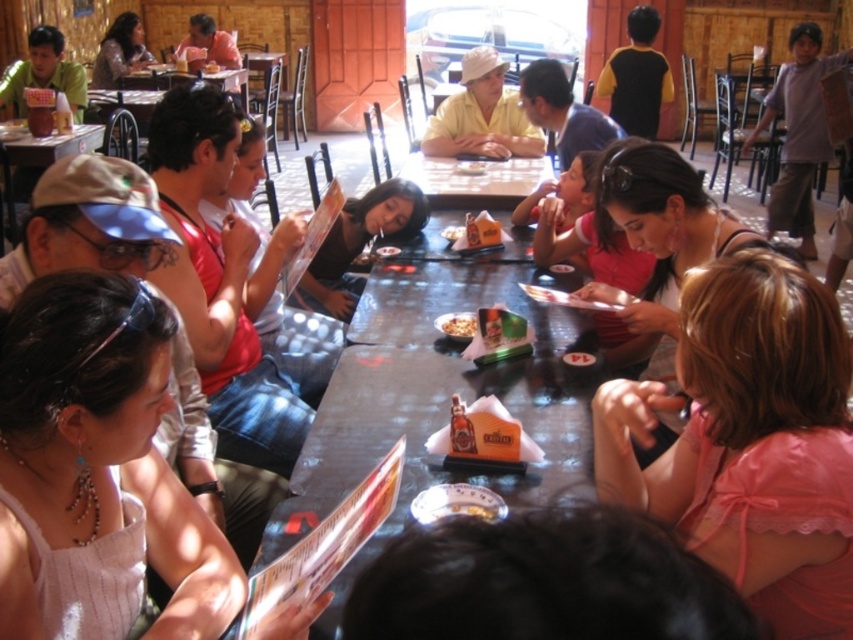
In the scene shown: Between wooden table at center and smooth white bowl at center, which one has less height?

Standing shorter between the two is smooth white bowl at center.

Does wooden table at center have a greater height compared to smooth white bowl at center?

Yes, wooden table at center is taller than smooth white bowl at center.

This screenshot has height=640, width=853. In order to click on wooden table at center in this screenshot , I will do `click(474, 180)`.

Which is in front, point (840, 401) or point (239, 74)?

Point (840, 401) is in front.

Describe the element at coordinates (749, 440) in the screenshot. I see `pink satin blouse at lower right` at that location.

Does point (650, 384) come behind point (154, 86)?

No, (650, 384) is in front of (154, 86).

Where is `pink satin blouse at lower right`? pink satin blouse at lower right is located at coordinates (749, 440).

Consider the image. Who is lower down, yellow matte hat at center or smooth brown bread at center?

Positioned lower is yellow matte hat at center.

Can you confirm if yellow matte hat at center is wider than smooth brown bread at center?

Indeed, yellow matte hat at center has a greater width compared to smooth brown bread at center.

Which is behind, point (440, 124) or point (207, 67)?

Positioned behind is point (207, 67).

Where is `yellow matte hat at center`? The width and height of the screenshot is (853, 640). yellow matte hat at center is located at coordinates (482, 115).